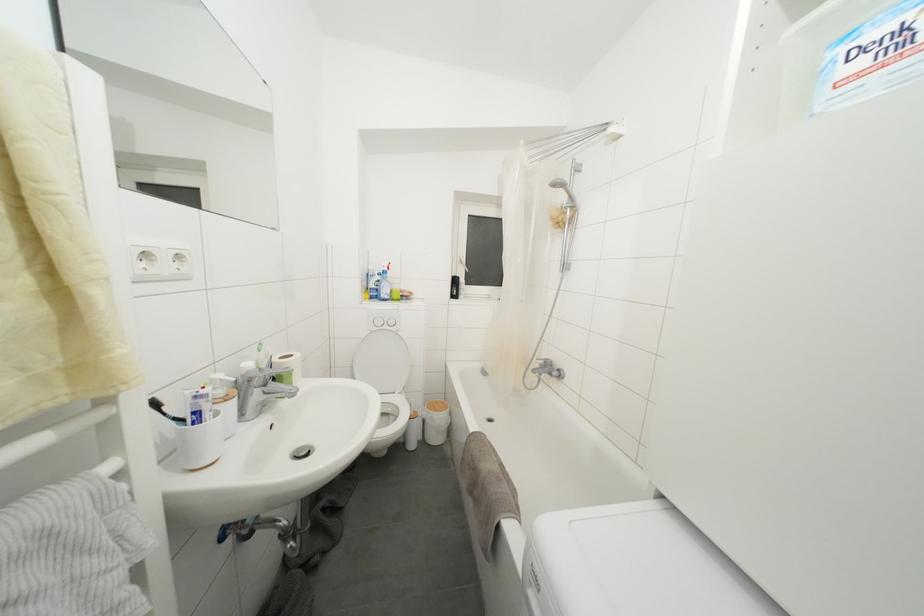
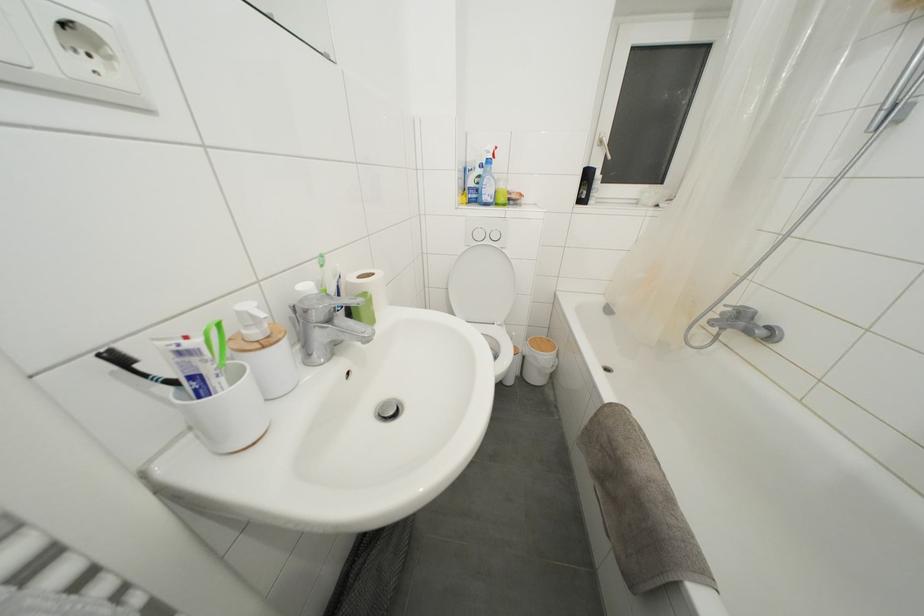
Where in the second image is the point corresponding to point (200, 402) from the first image?

(185, 358)